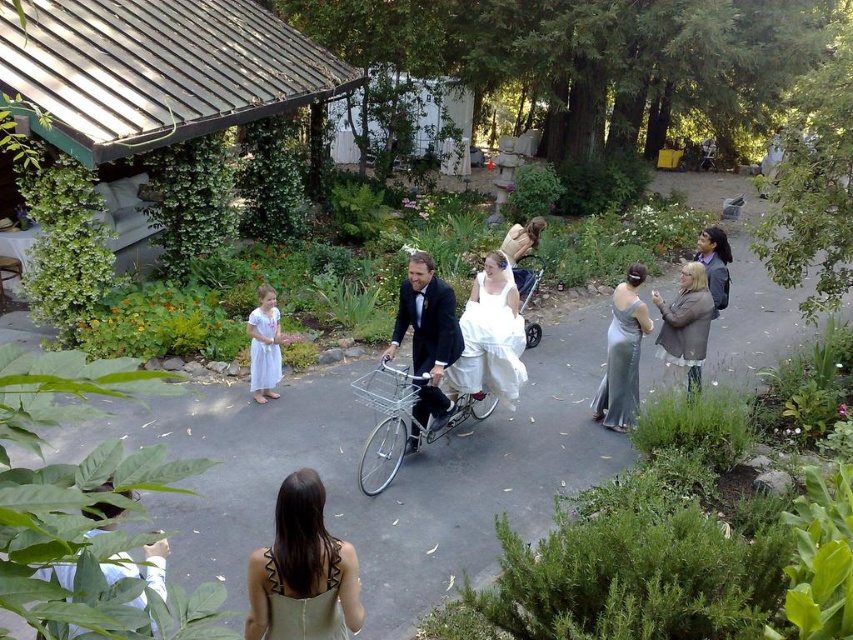
Question: Which object is the farthest from the satin silver dress at center?

Choices:
 (A) shiny black suit at center
 (B) green textured dress at lower center

Answer: (B)

Question: Does green textured dress at lower center appear on the right side of satin silver dress at center?

Choices:
 (A) no
 (B) yes

Answer: (A)

Question: Which of these objects is positioned closest to the matte black bicycle at center?

Choices:
 (A) gray wool coat at center right
 (B) green textured dress at lower center
 (C) shiny black suit at center
 (D) light green fabric dress at lower center

Answer: (D)

Question: Can you confirm if light green fabric dress at lower center is smaller than silver metallic bicycle at center?

Choices:
 (A) yes
 (B) no

Answer: (A)

Question: Considering the real-world distances, which object is farthest from the satin silver dress at center?

Choices:
 (A) matte black bicycle at center
 (B) shiny black suit at center
 (C) white satin dress at left
 (D) white satin dress at center

Answer: (A)

Question: Can you confirm if silver metallic bicycle at center is positioned below gray wool coat at center right?

Choices:
 (A) no
 (B) yes

Answer: (B)